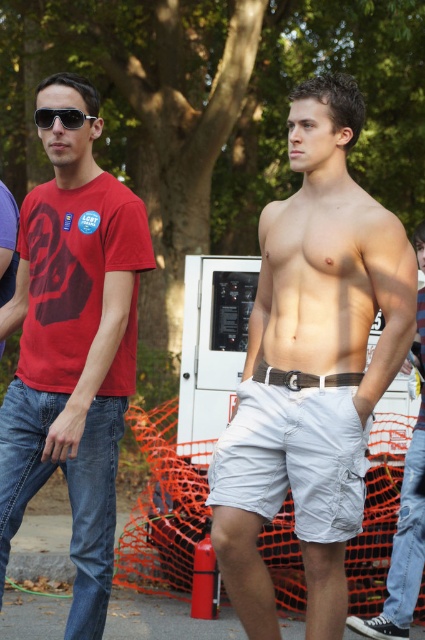
Question: Which is farther from the black plastic sunglasses at upper left?

Choices:
 (A) light beige shorts at center
 (B) light beige cotton shorts at center
 (C) white cotton shorts at center

Answer: (A)

Question: Which of these objects is positioned closest to the light beige cotton shorts at center?

Choices:
 (A) light beige shorts at center
 (B) matte red t-shirt at left
 (C) black plastic sunglasses at upper left
 (D) white cotton shorts at center

Answer: (D)

Question: Is light beige cotton shorts at center to the left of black plastic sunglasses at upper left from the viewer's perspective?

Choices:
 (A) yes
 (B) no

Answer: (B)

Question: Which object appears closest to the camera in this image?

Choices:
 (A) light beige shorts at center
 (B) matte red t-shirt at left
 (C) light beige cotton shorts at center

Answer: (B)

Question: Can you confirm if light beige shorts at center is wider than black plastic sunglasses at upper left?

Choices:
 (A) yes
 (B) no

Answer: (A)

Question: Can you confirm if light beige cotton shorts at center is positioned below matte red t-shirt at left?

Choices:
 (A) no
 (B) yes

Answer: (A)